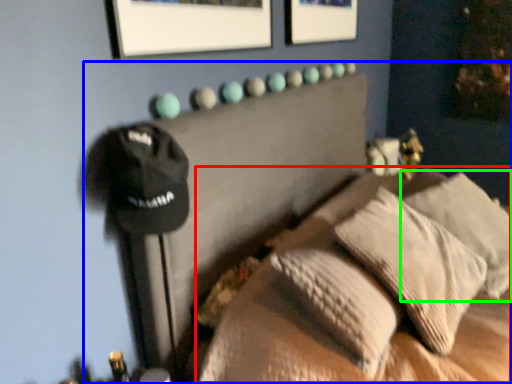
Question: Which is nearer to the bed (highlighted by a red box)? furniture (highlighted by a blue box) or pillow (highlighted by a green box).

Choices:
 (A) furniture
 (B) pillow

Answer: (A)